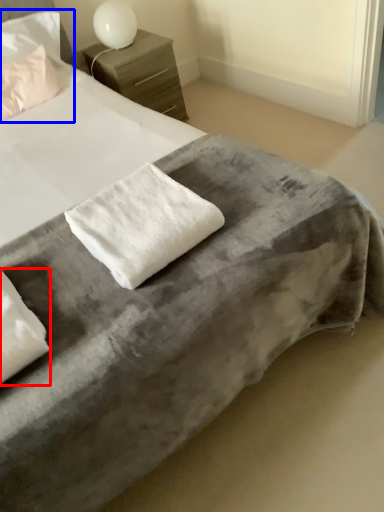
Question: Which of the following is the farthest to the observer, pillow (highlighted by a red box) or pillow (highlighted by a blue box)?

Choices:
 (A) pillow
 (B) pillow

Answer: (B)